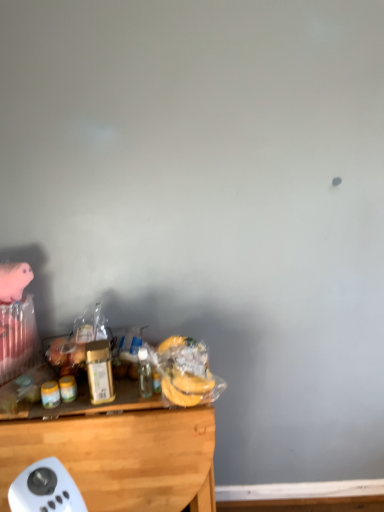
Identify the location of vacant area that lies between translucent plastic bananas at lower center, acting as the first food starting from the right, and yellow matte jar at left, the 1th food in the left-to-right sequence. This screenshot has height=512, width=384. (116, 404).